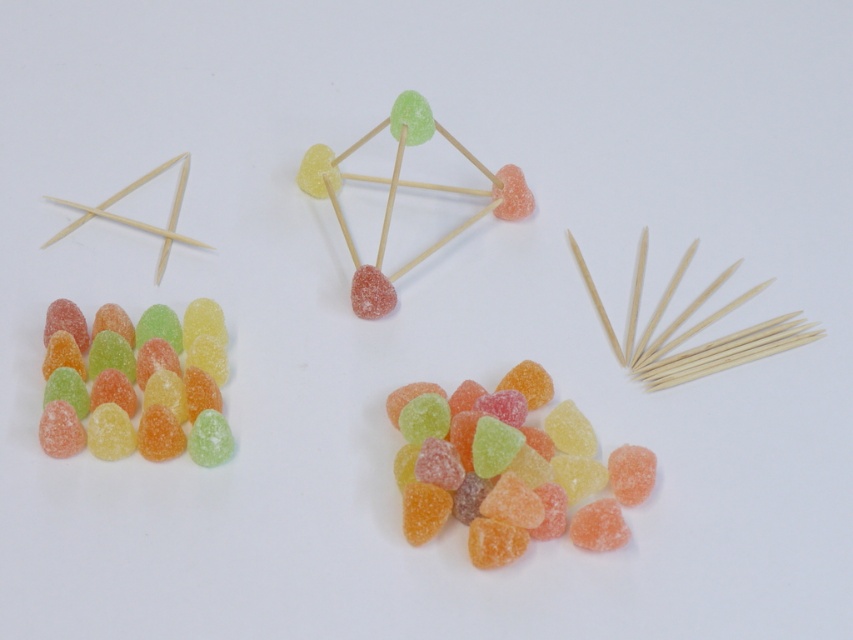
Who is higher up, glossy sugar-coated candies at center or sugary translucent candies at left?

sugary translucent candies at left

Between point (531, 531) and point (109, 348), which one is positioned behind?

Positioned behind is point (109, 348).

The height and width of the screenshot is (640, 853). In order to click on glossy sugar-coated candies at center in this screenshot , I will do `click(509, 468)`.